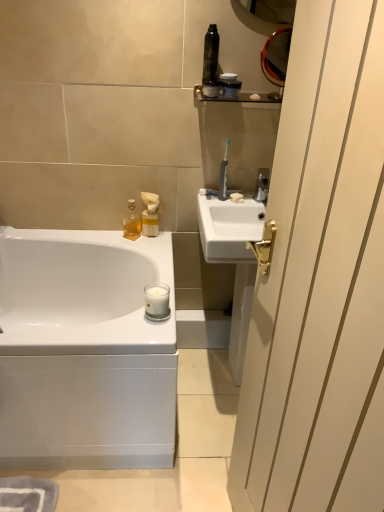
What are the coordinates of `blank space situated above metallic silver shelf at upper center (from a real-world perspective)` in the screenshot? It's located at (242, 85).